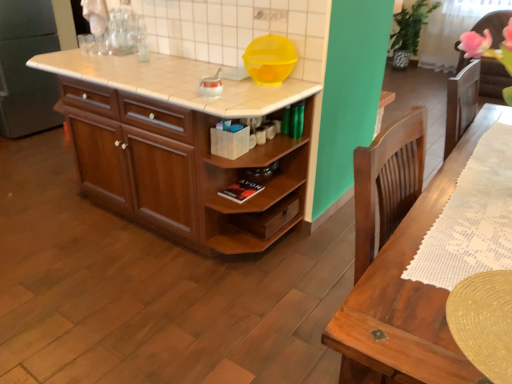
Locate an element on the screen. free space in front of white glossy kettle at center, which ranks as the 2th appliance in right-to-left order is located at coordinates (213, 110).